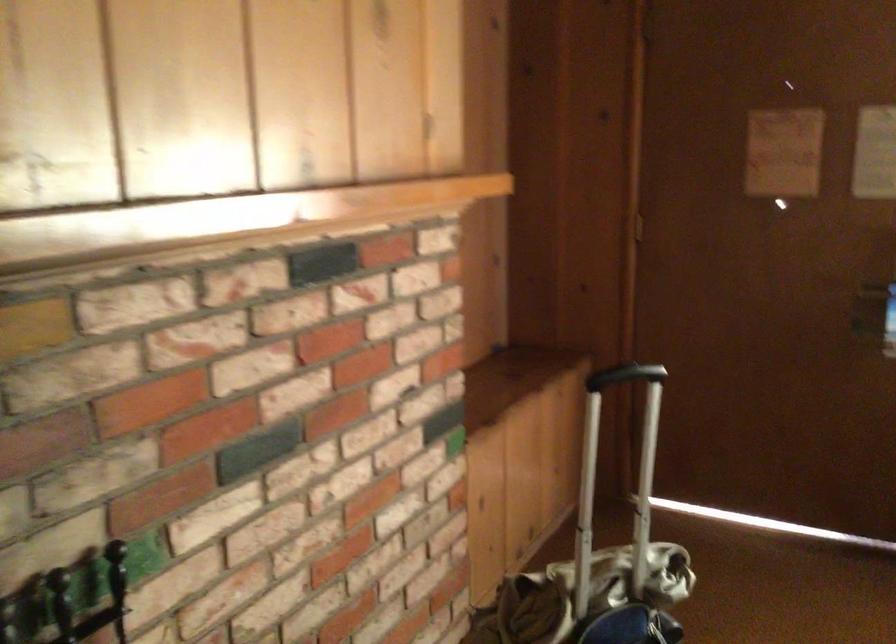
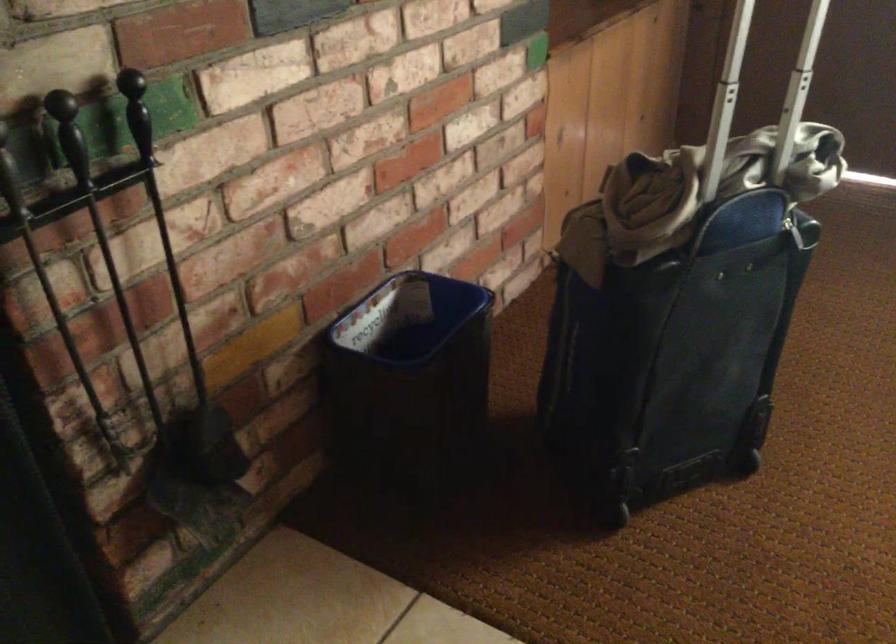
Question: What movement of the cameraman would produce the second image?

Choices:
 (A) Left
 (B) Right
 (C) Forward
 (D) Backward

Answer: (C)